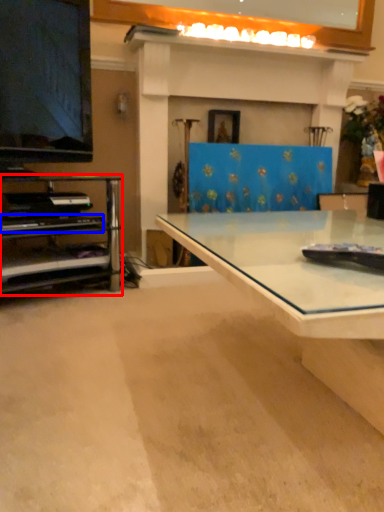
Question: Among these objects, which one is nearest to the camera, shelf (highlighted by a red box) or piano (highlighted by a blue box)?

Choices:
 (A) shelf
 (B) piano

Answer: (A)